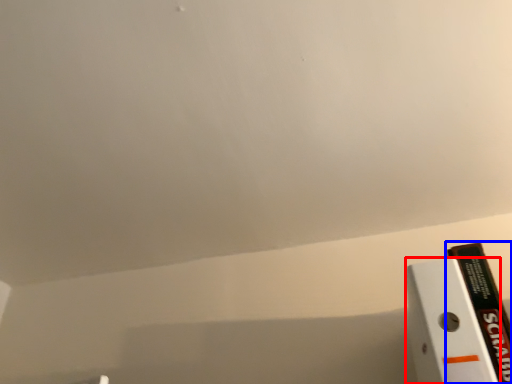
Question: Which object is closer to the camera taking this photo, paperback book (highlighted by a red box) or book (highlighted by a blue box)?

Choices:
 (A) paperback book
 (B) book

Answer: (A)